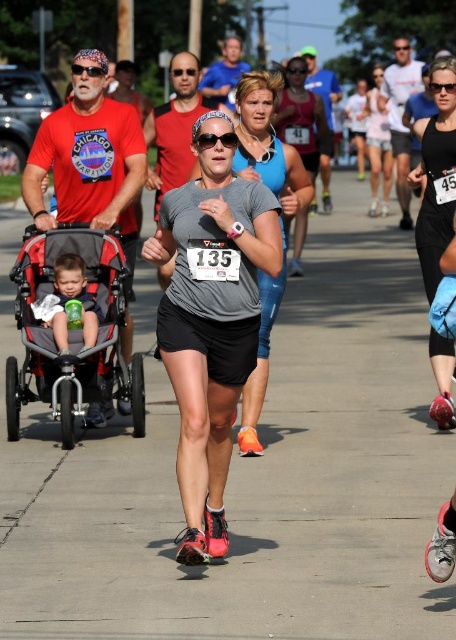
Describe the element at coordinates (268, 144) in the screenshot. The height and width of the screenshot is (640, 456). I see `gray matte tank top at center` at that location.

Based on the photo, who is more distant from viewer, (285, 196) or (373, 173)?

Positioned behind is point (373, 173).

The width and height of the screenshot is (456, 640). In order to click on gray matte tank top at center in this screenshot , I will do `click(268, 144)`.

Who is more distant from viewer, (264, 278) or (300, 221)?

Point (300, 221)

Who is lower down, gray matte tank top at center or matte blue tank top at center?

gray matte tank top at center is below.

Image resolution: width=456 pixels, height=640 pixels. I want to click on gray matte tank top at center, so click(x=268, y=144).

I want to click on gray matte tank top at center, so (x=268, y=144).

In the scene shown: Is gray concrete pavement at center shorter than pink fabric tank top at upper center?

Yes, gray concrete pavement at center is shorter than pink fabric tank top at upper center.

Does point (408, 460) lie behind point (378, 129)?

No, (408, 460) is in front of (378, 129).

Locate an element on the screen. The image size is (456, 640). gray concrete pavement at center is located at coordinates (248, 472).